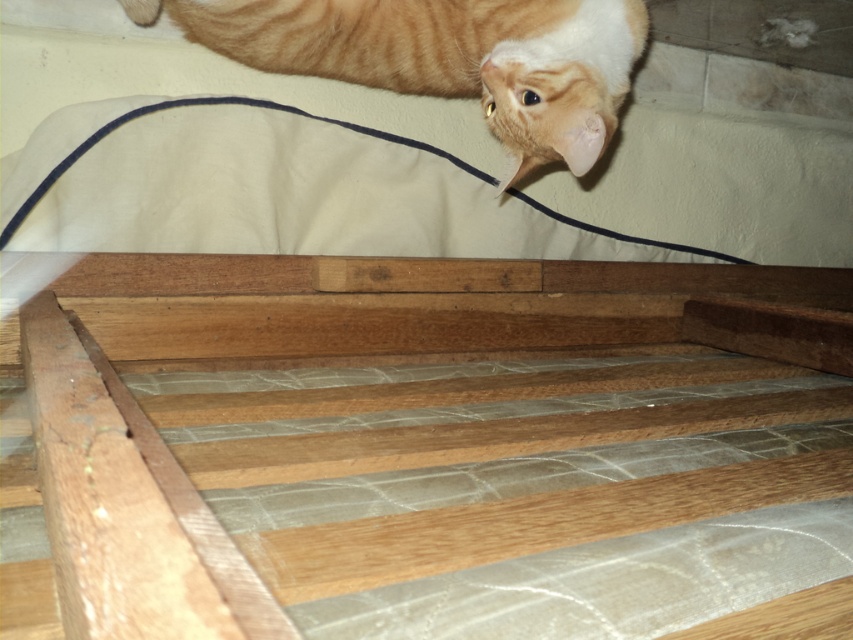
Question: Is wooden slats at center further to the viewer compared to orange striped fur at upper center?

Choices:
 (A) no
 (B) yes

Answer: (A)

Question: Which object appears closest to the camera in this image?

Choices:
 (A) wooden slats at center
 (B) orange striped fur at upper center

Answer: (A)

Question: Which point is closer to the camera taking this photo?

Choices:
 (A) (273, 257)
 (B) (503, 81)

Answer: (B)

Question: Is wooden slats at center thinner than orange striped fur at upper center?

Choices:
 (A) no
 (B) yes

Answer: (A)

Question: Can you confirm if wooden slats at center is thinner than orange striped fur at upper center?

Choices:
 (A) yes
 (B) no

Answer: (B)

Question: Which of the following is the farthest from the observer?

Choices:
 (A) wooden slats at center
 (B) orange striped fur at upper center

Answer: (B)